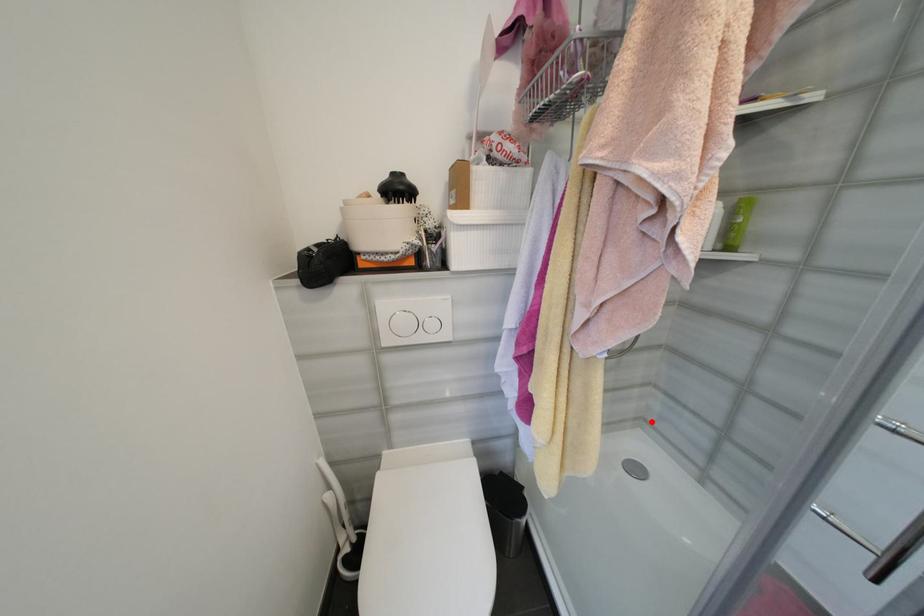
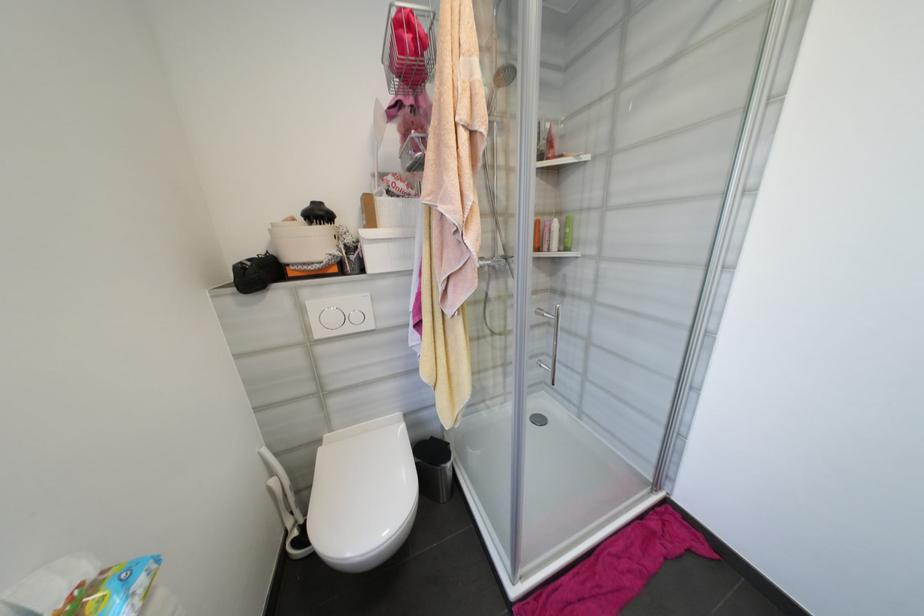
Find the pixel in the second image that matches the highlighted location in the first image.

(552, 384)